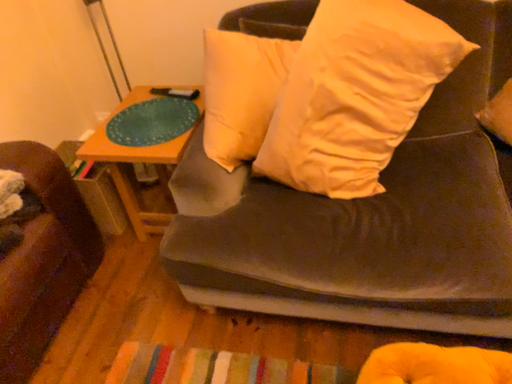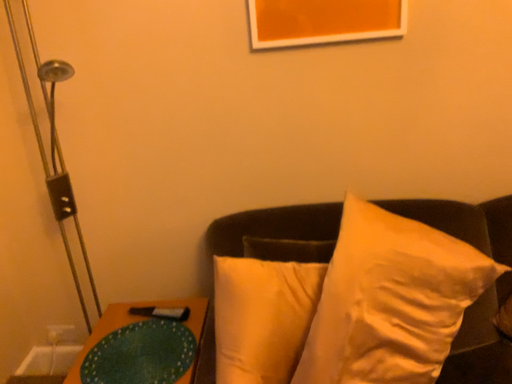
Question: Which way did the camera rotate in the video?

Choices:
 (A) rotated left
 (B) rotated right

Answer: (B)